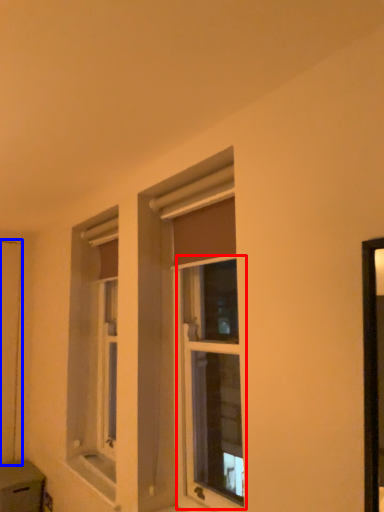
Question: Which object appears farthest to the camera in this image, window (highlighted by a red box) or screen door (highlighted by a blue box)?

Choices:
 (A) window
 (B) screen door

Answer: (B)